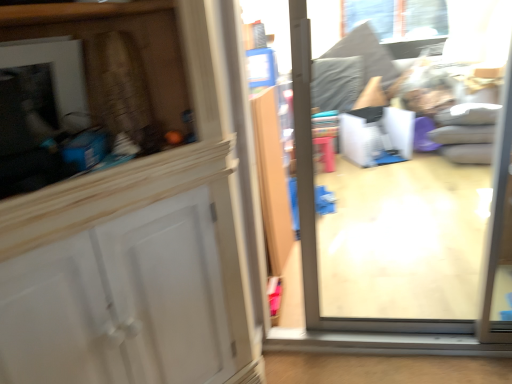
The height and width of the screenshot is (384, 512). What do you see at coordinates (409, 207) in the screenshot?
I see `transparent glass door at center` at bounding box center [409, 207].

Where is `transparent glass door at center`? transparent glass door at center is located at coordinates (409, 207).

What do you see at coordinates (397, 17) in the screenshot? The width and height of the screenshot is (512, 384). I see `clear glass window at upper center` at bounding box center [397, 17].

Find the location of a particular element. clear glass window at upper center is located at coordinates (397, 17).

At what (x,y) coordinates should I click in order to perform the action: click on transparent glass door at center. Please return your answer as a coordinate pair (x, y). This screenshot has height=384, width=512. Looking at the image, I should click on click(x=409, y=207).

Which object is positioned more to the right, clear glass window at upper center or transparent glass door at center?

Positioned to the right is clear glass window at upper center.

Who is more distant, clear glass window at upper center or transparent glass door at center?

clear glass window at upper center is more distant.

Is point (388, 5) positioned behind point (343, 55)?

No, it is not.

From the image's perspective, between clear glass window at upper center and transparent glass door at center, who is located below?

transparent glass door at center appears lower in the image.

From the picture: From a real-world perspective, who is located higher, clear glass window at upper center or transparent glass door at center?

clear glass window at upper center, from a real-world perspective.

Does clear glass window at upper center have a greater width compared to transparent glass door at center?

No.

Who is shorter, clear glass window at upper center or transparent glass door at center?

With less height is clear glass window at upper center.

Considering the relative sizes of clear glass window at upper center and transparent glass door at center in the image provided, is clear glass window at upper center smaller than transparent glass door at center?

Yes.

Is clear glass window at upper center spatially inside transparent glass door at center, or outside of it?

clear glass window at upper center is not enclosed by transparent glass door at center.

Is clear glass window at upper center positioned far away from transparent glass door at center?

clear glass window at upper center is positioned a significant distance from transparent glass door at center.

Is clear glass window at upper center oriented towards transparent glass door at center?

Yes, clear glass window at upper center is turned towards transparent glass door at center.

Can you tell me how much clear glass window at upper center and transparent glass door at center differ in facing direction?

The facing directions of clear glass window at upper center and transparent glass door at center are 0.585 degrees apart.

How far apart are clear glass window at upper center and transparent glass door at center?

clear glass window at upper center and transparent glass door at center are 3.62 feet apart.

Find the location of a particular element. window behind the transparent glass door at center is located at coordinates (397, 17).

Is transparent glass door at center to the left or to the right of clear glass window at upper center in the image?

In the image, transparent glass door at center appears on the left side of clear glass window at upper center.

Considering the relative positions of transparent glass door at center and clear glass window at upper center in the image provided, is transparent glass door at center behind clear glass window at upper center?

No, the depth of transparent glass door at center is less than that of clear glass window at upper center.

Does point (378, 116) lie behind point (379, 14)?

No.

From the image's perspective, is transparent glass door at center above or below clear glass window at upper center?

transparent glass door at center is below clear glass window at upper center.

From a real-world perspective, which is physically above, transparent glass door at center or clear glass window at upper center?

clear glass window at upper center.

In terms of width, does transparent glass door at center look wider or thinner when compared to clear glass window at upper center?

transparent glass door at center is wider than clear glass window at upper center.

From their relative heights in the image, would you say transparent glass door at center is taller or shorter than clear glass window at upper center?

In the image, transparent glass door at center appears to be taller than clear glass window at upper center.

In terms of size, does transparent glass door at center appear bigger or smaller than clear glass window at upper center?

transparent glass door at center is bigger than clear glass window at upper center.

Based on the photo, is transparent glass door at center located outside clear glass window at upper center?

Yes, transparent glass door at center is outside of clear glass window at upper center.

Is transparent glass door at center touching clear glass window at upper center?

There is a gap between transparent glass door at center and clear glass window at upper center.

Could you tell me if transparent glass door at center is turned towards clear glass window at upper center?

No, transparent glass door at center does not turn towards clear glass window at upper center.

Locate an element on the screen. The image size is (512, 384). glass door that appears in front of the clear glass window at upper center is located at coordinates (409, 207).

You are a GUI agent. You are given a task and a screenshot of the screen. Output one action in this format:
    pyautogui.click(x=<x>, y=<y>)
    Task: Click on the window above the transparent glass door at center (from the image's perspective)
    This screenshot has height=384, width=512.
    Given the screenshot: What is the action you would take?
    pyautogui.click(x=397, y=17)

The width and height of the screenshot is (512, 384). I want to click on glass door in front of the clear glass window at upper center, so click(409, 207).